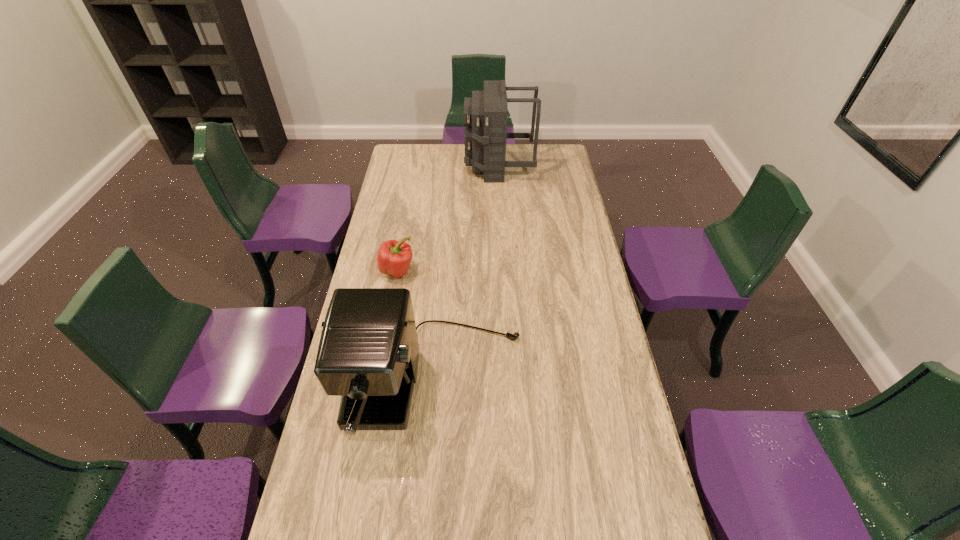
Locate an element on the screen. the farthest object is located at coordinates (485, 114).

Identify the location of backpack. (485, 114).

The width and height of the screenshot is (960, 540). What are the coordinates of `the nearest object` in the screenshot? It's located at (368, 354).

At what (x,y) coordinates should I click in order to perform the action: click on the second tallest object. Please return your answer as a coordinate pair (x, y). The image size is (960, 540). Looking at the image, I should click on (368, 354).

The image size is (960, 540). Find the location of `bell pepper`. bell pepper is located at coordinates (394, 258).

I want to click on the shortest object, so pos(394,258).

Where is `vacant space located on the front compartment of the tallest object`? This screenshot has width=960, height=540. vacant space located on the front compartment of the tallest object is located at coordinates (449, 166).

Find the location of a particular element. This screenshot has width=960, height=540. free space located 0.230m on the front compartment of the tallest object is located at coordinates (420, 166).

Locate an element on the screen. vacant space situated on the front compartment of the tallest object is located at coordinates (405, 166).

I want to click on free spot located 0.100m on the front-facing side of the coffee maker, so click(x=424, y=496).